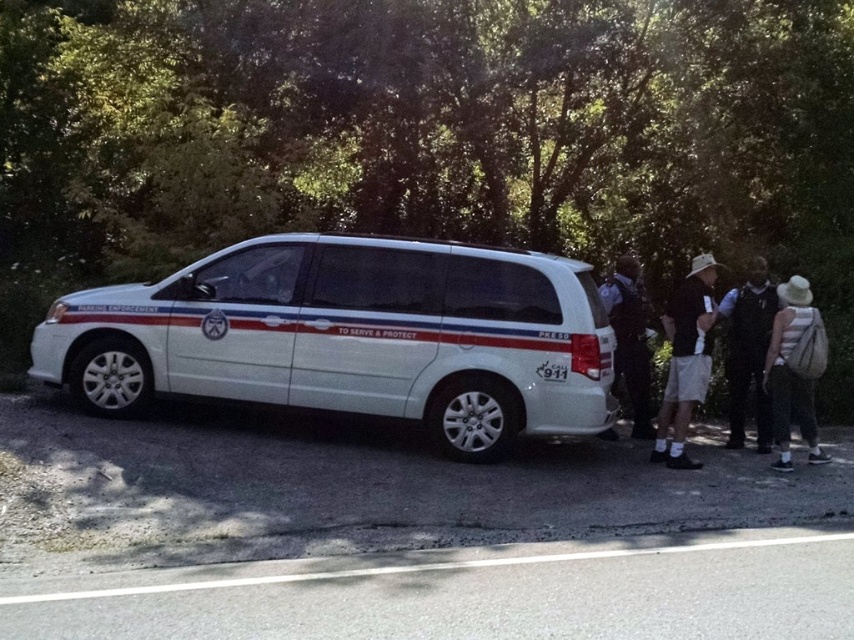
You are a pedestrian standing at the origin point of a coordinate system where the image is mapped. The white glossy minivan at center is at position 0.528, 0.412. If you need to walk directly towards the van, which direction should you head?

Since the white glossy minivan at center is located at coordinates (351,337), you should head northeast to reach it from the origin point.

You are a pedestrian standing in front of the white police van. You see two people at the right side of the van wearing the white striped shirt at right and the black uniform at right. Which person is shorter?

The white striped shirt at right has a lesser height compared to the black uniform at right, so the person wearing the white striped shirt at right is shorter.

You are standing in front of the white police van and want to locate two specific points on its license plate. The first point is at coordinates point (695, 371) and the second point is at point (651, 429). Which point is closer to you?

Point (695, 371) is closer to the viewer than point (651, 429).